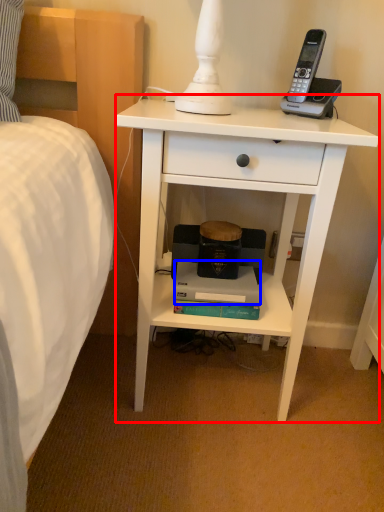
Question: Among these objects, which one is nearest to the camera, nightstand (highlighted by a red box) or paperback book (highlighted by a blue box)?

Choices:
 (A) nightstand
 (B) paperback book

Answer: (A)